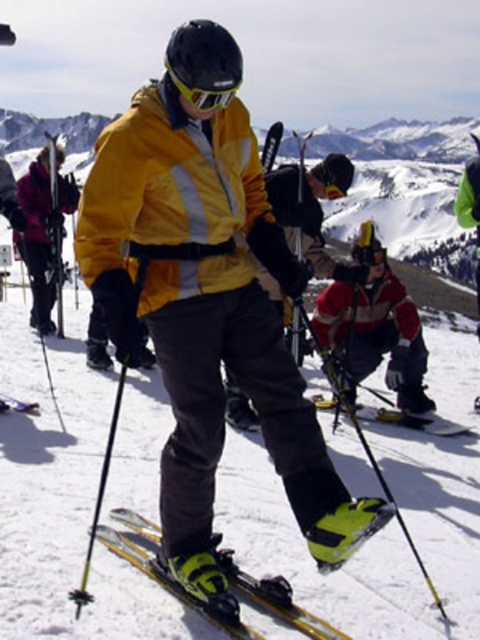
Is yellow matte jacket at center positioned before red matte jacket at center?

Yes, yellow matte jacket at center is closer to the viewer.

Does yellow matte jacket at center have a smaller size compared to red matte jacket at center?

No.

Image resolution: width=480 pixels, height=640 pixels. What are the coordinates of `yellow matte jacket at center` in the screenshot? It's located at (206, 320).

In order to click on yellow matte jacket at center in this screenshot , I will do `click(206, 320)`.

Which of these two, matte yellow jacket at center or shiny metallic ski at lower left, stands taller?

matte yellow jacket at center

Can you confirm if matte yellow jacket at center is positioned below shiny metallic ski at lower left?

No, matte yellow jacket at center is not below shiny metallic ski at lower left.

You are a GUI agent. You are given a task and a screenshot of the screen. Output one action in this format:
    pyautogui.click(x=<x>, y=<y>)
    Task: Click on the matte yellow jacket at center
    Image resolution: width=480 pixels, height=640 pixels.
    Given the screenshot: What is the action you would take?
    pyautogui.click(x=171, y=196)

The width and height of the screenshot is (480, 640). In order to click on matte yellow jacket at center in this screenshot , I will do `click(171, 196)`.

Identify the location of matte black ski pole at left. The height and width of the screenshot is (640, 480). (41, 234).

Is point (39, 323) less distant than point (0, 410)?

No, (39, 323) is behind (0, 410).

At what (x,y) coordinates should I click in order to perform the action: click on matte black ski pole at left. Please return your answer as a coordinate pair (x, y). This screenshot has width=480, height=640. Looking at the image, I should click on pos(41,234).